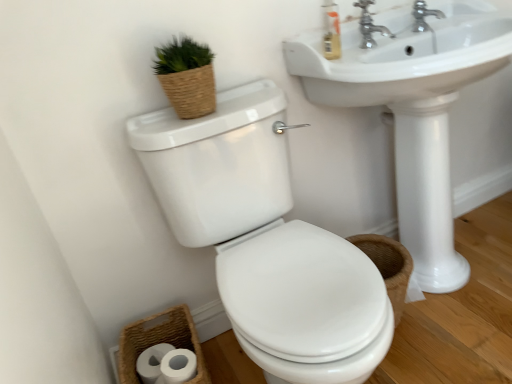
This screenshot has height=384, width=512. Describe the element at coordinates (370, 25) in the screenshot. I see `satin nickel faucet at upper right, the 2th tap from the right` at that location.

I want to click on satin nickel faucet at upper right, the 2th tap from the right, so click(x=370, y=25).

This screenshot has height=384, width=512. I want to click on translucent plastic soap dispenser at upper right, so click(331, 31).

Describe the element at coordinates (265, 240) in the screenshot. I see `white glossy toilet at center` at that location.

What do you see at coordinates (177, 367) in the screenshot?
I see `white matte toilet paper at lower left` at bounding box center [177, 367].

Image resolution: width=512 pixels, height=384 pixels. Describe the element at coordinates (159, 341) in the screenshot. I see `woven brown basket at lower left` at that location.

Locate an element on the screen. satin nickel faucet at upper right, the 2th tap from the right is located at coordinates (370, 25).

Is white glossy toilet at center turned away from white matte toilet paper at lower left?

No, white matte toilet paper at lower left is not at the back of white glossy toilet at center.

Considering the relative positions of white glossy toilet at center and white matte toilet paper at lower left in the image provided, is white glossy toilet at center to the left of white matte toilet paper at lower left from the viewer's perspective?

No, white glossy toilet at center is not to the left of white matte toilet paper at lower left.

Which is farther from the camera, (340, 355) or (158, 383)?

The point (158, 383) is more distant.

Consider the image. Can we say translucent plastic soap dispenser at upper right lies outside white glossy toilet at center?

Yes, translucent plastic soap dispenser at upper right is not within white glossy toilet at center.

Considering the sizes of objects translucent plastic soap dispenser at upper right and white glossy toilet at center in the image provided, who is smaller, translucent plastic soap dispenser at upper right or white glossy toilet at center?

translucent plastic soap dispenser at upper right is smaller.

Looking at this image, is translucent plastic soap dispenser at upper right not near white glossy toilet at center?

That's not correct — translucent plastic soap dispenser at upper right is a little close to white glossy toilet at center.

Is translucent plastic soap dispenser at upper right inside or outside of woven brown basket at lower left?

translucent plastic soap dispenser at upper right is not inside woven brown basket at lower left, it's outside.

From the image's perspective, which object appears higher, translucent plastic soap dispenser at upper right or woven brown basket at lower left?

translucent plastic soap dispenser at upper right appears higher in the image.

From a real-world perspective, relative to woven brown basket at lower left, is translucent plastic soap dispenser at upper right vertically above or below?

Clearly, from a real-world perspective, translucent plastic soap dispenser at upper right is above woven brown basket at lower left.

I want to click on basket on the left of translucent plastic soap dispenser at upper right, so click(x=159, y=341).

From the image's perspective, does white glossy sink at center appear higher than satin nickel faucet at upper right, the 2th tap from the right?

Incorrect, from the image's perspective, white glossy sink at center is lower than satin nickel faucet at upper right, the 2th tap from the right.

From a real-world perspective, who is located lower, white glossy sink at center or satin nickel faucet at upper right, the 2th tap from the right?

From a 3D spatial view, white glossy sink at center is below.

Based on their positions, is white glossy sink at center located to the left or right of satin nickel faucet at upper right, the first tap when ordered from left to right?

In the image, white glossy sink at center appears on the right side of satin nickel faucet at upper right, the first tap when ordered from left to right.

Consider the image. Is translucent plastic soap dispenser at upper right aimed at satin nickel faucet at upper right, the first tap when ordered from left to right?

No.

From a real-world perspective, is translucent plastic soap dispenser at upper right positioned under satin nickel faucet at upper right, the first tap when ordered from left to right, based on gravity?

No, from a real-world perspective, translucent plastic soap dispenser at upper right is not under satin nickel faucet at upper right, the first tap when ordered from left to right.

Can you tell me how much translucent plastic soap dispenser at upper right and satin nickel faucet at upper right, the first tap when ordered from left to right, differ in facing direction?

The angular difference between translucent plastic soap dispenser at upper right and satin nickel faucet at upper right, the first tap when ordered from left to right, is 2.25 degrees.

From the image's perspective, is translucent plastic soap dispenser at upper right positioned above or below satin nickel faucet at upper right, the 2th tap from the right?

Clearly, from the image's perspective, translucent plastic soap dispenser at upper right is below satin nickel faucet at upper right, the 2th tap from the right.

Is white glossy sink at center wider or thinner than silver metallic faucet at upper right, the second tap positioned from the left?

white glossy sink at center is wider than silver metallic faucet at upper right, the second tap positioned from the left.

Which is more to the left, white glossy sink at center or silver metallic faucet at upper right, which appears as the first tap when viewed from the right?

silver metallic faucet at upper right, which appears as the first tap when viewed from the right, is more to the left.

Is white glossy sink at center positioned beyond the bounds of silver metallic faucet at upper right, the second tap positioned from the left?

Yes, white glossy sink at center is outside of silver metallic faucet at upper right, the second tap positioned from the left.

Based on the photo, from the image's perspective, is white glossy toilet at center above satin nickel faucet at upper right, the 2th tap from the right?

No, from the image's perspective, white glossy toilet at center is not over satin nickel faucet at upper right, the 2th tap from the right.

Consider the image. Between white glossy toilet at center and satin nickel faucet at upper right, the first tap when ordered from left to right, which one is positioned behind?

satin nickel faucet at upper right, the first tap when ordered from left to right.

Is white glossy toilet at center placed right next to satin nickel faucet at upper right, the first tap when ordered from left to right?

No, white glossy toilet at center is not touching satin nickel faucet at upper right, the first tap when ordered from left to right.

What are the coordinates of `toilet above the white matte toilet paper at lower left (from a real-world perspective)` in the screenshot? It's located at (265, 240).

This screenshot has width=512, height=384. Find the location of `toilet below the translucent plastic soap dispenser at upper right (from the image's perspective)`. toilet below the translucent plastic soap dispenser at upper right (from the image's perspective) is located at coordinates (265, 240).

Estimate the real-world distances between objects in this image. Which object is further from satin nickel faucet at upper right, the 2th tap from the right, white matte toilet paper at lower left or white glossy sink at center?

white matte toilet paper at lower left lies further to satin nickel faucet at upper right, the 2th tap from the right, than the other object.

Looking at the image, which one is located closer to satin nickel faucet at upper right, the first tap when ordered from left to right, silver metallic faucet at upper right, the second tap positioned from the left, or translucent plastic soap dispenser at upper right?

Based on the image, translucent plastic soap dispenser at upper right appears to be nearer to satin nickel faucet at upper right, the first tap when ordered from left to right.

From the image, which object appears to be nearer to silver metallic faucet at upper right, which appears as the first tap when viewed from the right, satin nickel faucet at upper right, the 2th tap from the right, or translucent plastic soap dispenser at upper right?

The object closer to silver metallic faucet at upper right, which appears as the first tap when viewed from the right, is satin nickel faucet at upper right, the 2th tap from the right.

Which object lies nearer to the anchor point translucent plastic soap dispenser at upper right, satin nickel faucet at upper right, the 2th tap from the right, or white glossy toilet at center?

satin nickel faucet at upper right, the 2th tap from the right, is closer to translucent plastic soap dispenser at upper right.

Based on their spatial positions, is white glossy toilet at center or satin nickel faucet at upper right, the first tap when ordered from left to right, further from white matte toilet paper at lower left?

satin nickel faucet at upper right, the first tap when ordered from left to right, lies further to white matte toilet paper at lower left than the other object.

Considering their positions, is white glossy sink at center positioned further to white glossy toilet at center than satin nickel faucet at upper right, the first tap when ordered from left to right?

Based on the image, satin nickel faucet at upper right, the first tap when ordered from left to right, appears to be further to white glossy toilet at center.

Considering their positions, is white glossy sink at center positioned further to silver metallic faucet at upper right, the second tap positioned from the left, than satin nickel faucet at upper right, the first tap when ordered from left to right?

Based on the image, white glossy sink at center appears to be further to silver metallic faucet at upper right, the second tap positioned from the left.

Consider the image. Estimate the real-world distances between objects in this image. Which object is closer to white glossy sink at center, white glossy toilet at center or translucent plastic soap dispenser at upper right?

Among the two, translucent plastic soap dispenser at upper right is located nearer to white glossy sink at center.

At what (x,y) coordinates should I click in order to perform the action: click on sink between translucent plastic soap dispenser at upper right and white matte toilet paper at lower left from top to bottom. Please return your answer as a coordinate pair (x, y). Looking at the image, I should click on (413, 111).

You are a GUI agent. You are given a task and a screenshot of the screen. Output one action in this format:
    pyautogui.click(x=<x>, y=<y>)
    Task: Click on the toilet between translucent plastic soap dispenser at upper right and white matte toilet paper at lower left vertically
    This screenshot has height=384, width=512.
    Given the screenshot: What is the action you would take?
    pyautogui.click(x=265, y=240)

This screenshot has height=384, width=512. In order to click on soap dispenser between satin nickel faucet at upper right, the first tap when ordered from left to right, and white glossy sink at center in the up-down direction in this screenshot , I will do `click(331, 31)`.

Where is `soap dispenser between silver metallic faucet at upper right, which appears as the first tap when viewed from the right, and white glossy toilet at center vertically`? This screenshot has height=384, width=512. soap dispenser between silver metallic faucet at upper right, which appears as the first tap when viewed from the right, and white glossy toilet at center vertically is located at coordinates (331, 31).